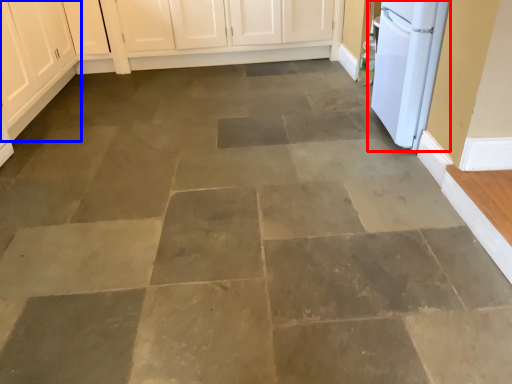
Question: Which point is closer to the camera, home appliance (highlighted by a red box) or cabinetry (highlighted by a blue box)?

Choices:
 (A) home appliance
 (B) cabinetry

Answer: (A)